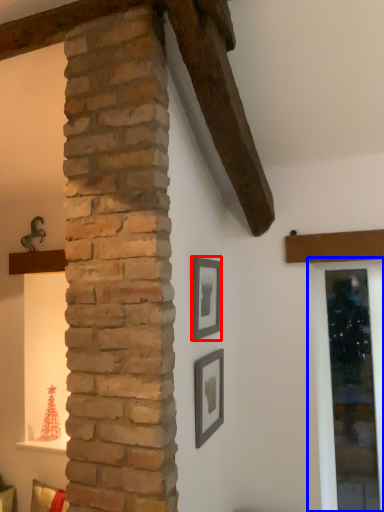
Question: Which of the following is the farthest to the observer, picture frame (highlighted by a red box) or window frame (highlighted by a blue box)?

Choices:
 (A) picture frame
 (B) window frame

Answer: (B)